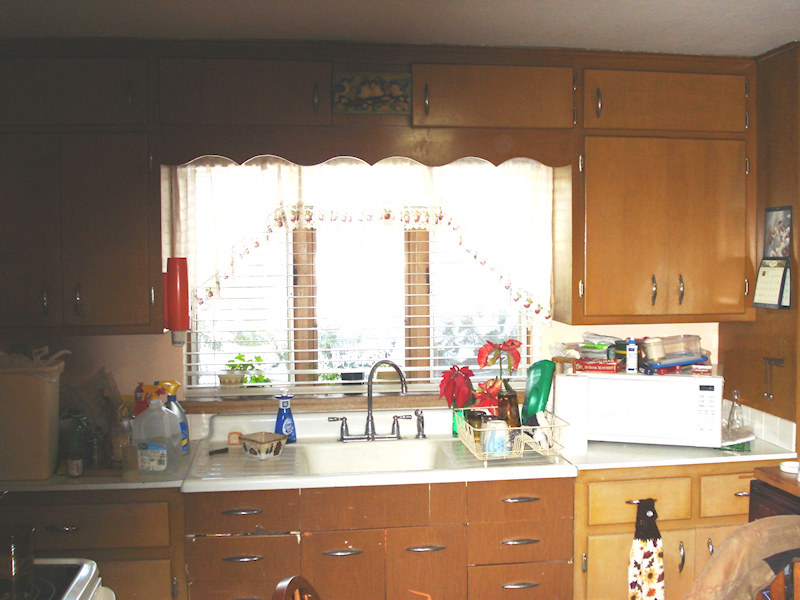
What are the coordinates of `red paper cup dispenser` in the screenshot? It's located at (177, 272).